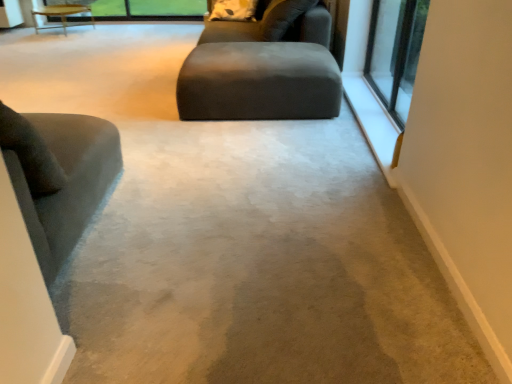
Find the location of a particular element. unoccupied area in front of matte gray ottoman at center is located at coordinates (256, 148).